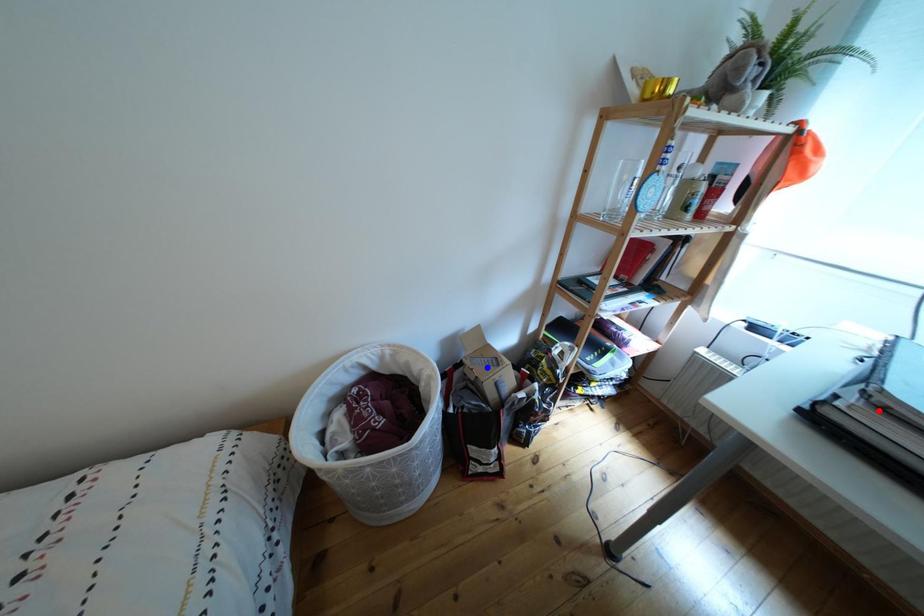
Question: Which of the two points in the image is closer to the camera?

Choices:
 (A) Blue point is closer.
 (B) Red point is closer.

Answer: (B)